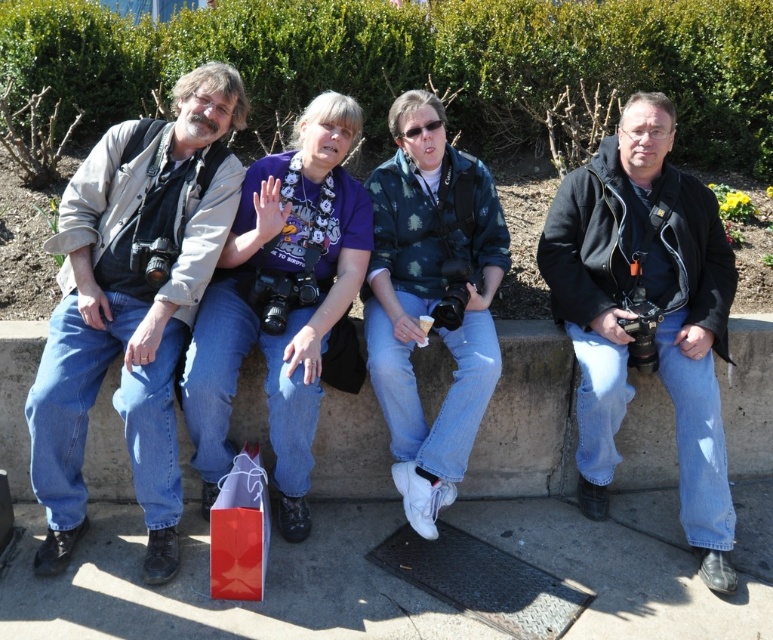
Question: Which object is farther from the camera taking this photo?

Choices:
 (A) smooth concrete at lower center
 (B) matte red shopping bag at lower center

Answer: (B)

Question: Which point is farther to the camera?

Choices:
 (A) (179, 352)
 (B) (707, 269)
 (C) (763, 474)
 (D) (223, 550)

Answer: (C)

Question: Which of the following is the farthest from the observer?

Choices:
 (A) (179, 108)
 (B) (584, 189)

Answer: (B)

Question: Can you confirm if black matte jacket at center is smaller than concrete ledge at center?

Choices:
 (A) no
 (B) yes

Answer: (A)

Question: Is matte black jacket at left above concrete ledge at center?

Choices:
 (A) yes
 (B) no

Answer: (A)

Question: Is black matte jacket at center below concrete ledge at center?

Choices:
 (A) no
 (B) yes

Answer: (A)